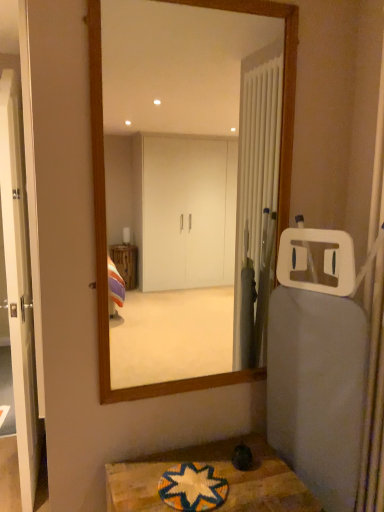
The image size is (384, 512). Find the location of `blank space situated above wooden textured table at lower center (from a real-world perspective)`. blank space situated above wooden textured table at lower center (from a real-world perspective) is located at coordinates (203, 477).